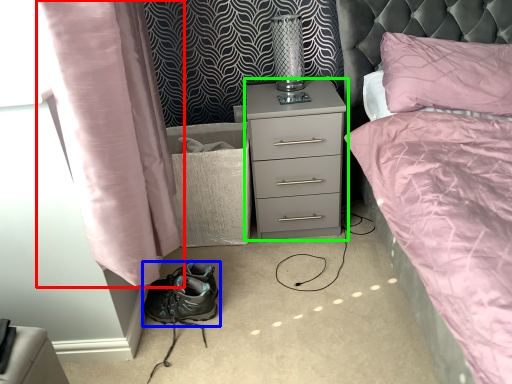
Question: Which object is the closest to the curtain (highlighted by a red box)? Choose among these: footwear (highlighted by a blue box) or nightstand (highlighted by a green box).

Choices:
 (A) footwear
 (B) nightstand

Answer: (A)